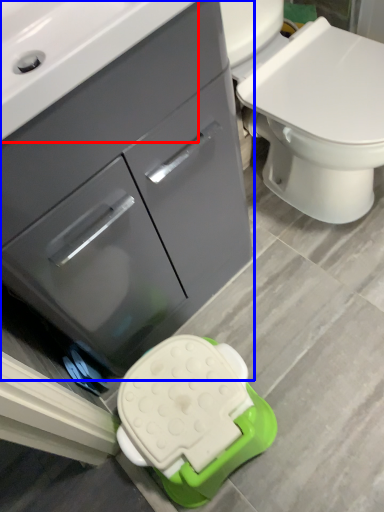
Question: Which object appears farthest to the camera in this image, sink (highlighted by a red box) or bathroom cabinet (highlighted by a blue box)?

Choices:
 (A) sink
 (B) bathroom cabinet

Answer: (B)